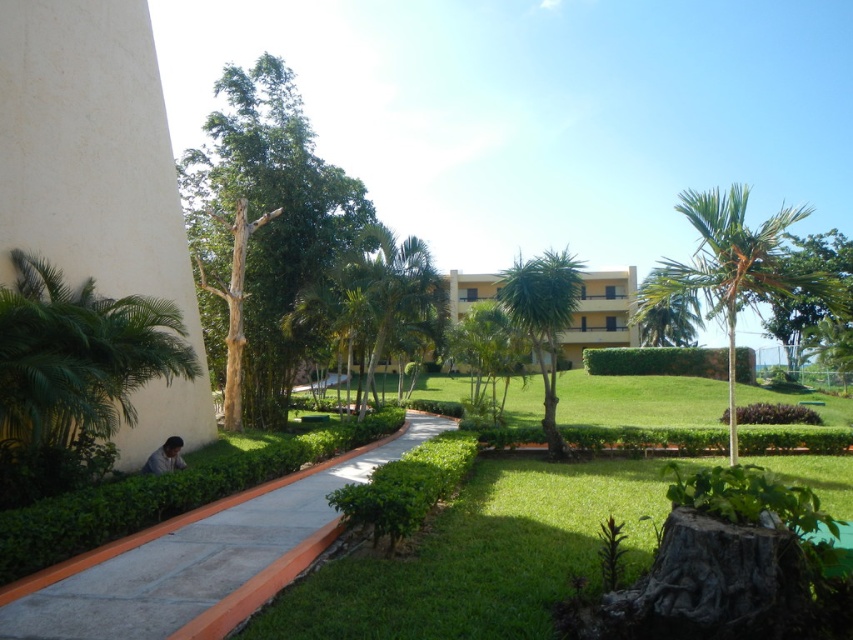
Question: Which point is farther to the camera?

Choices:
 (A) concrete at center
 (B) green leafy tree at upper right
 (C) green leafy palm tree at upper right

Answer: (C)

Question: Estimate the real-world distances between objects in this image. Which object is closer to the green leafy tree at left?

Choices:
 (A) green leafy palm tree at upper right
 (B) yellow matte building at center

Answer: (A)

Question: Can you confirm if green leafy tree at left is thinner than green leafy tree at upper right?

Choices:
 (A) yes
 (B) no

Answer: (A)

Question: Can you confirm if green leafy palm tree at upper right is positioned to the right of yellow matte building at center?

Choices:
 (A) no
 (B) yes

Answer: (B)

Question: Which object appears closest to the camera in this image?

Choices:
 (A) green leafy palm tree at center
 (B) yellow matte building at center
 (C) green leafy palm tree at upper right

Answer: (C)

Question: Where is green leafy palm at lower left located in relation to green leafy palm tree at upper right in the image?

Choices:
 (A) below
 (B) above

Answer: (A)